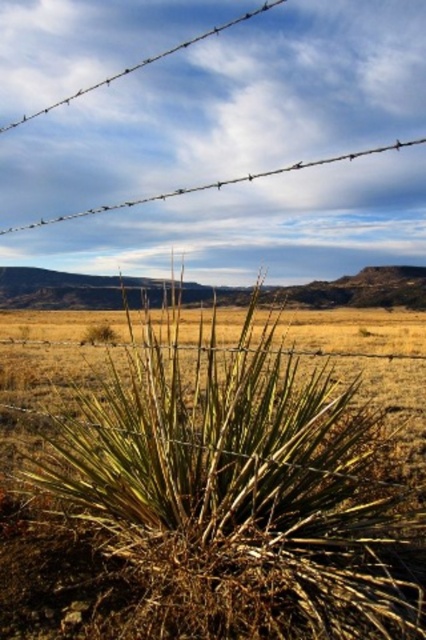
Question: Is the position of brown dry grass at center less distant than that of wire at upper center?

Choices:
 (A) yes
 (B) no

Answer: (A)

Question: Which point is closer to the camera?

Choices:
 (A) (147, 198)
 (B) (305, 467)

Answer: (B)

Question: Does brown dry grass at center have a greater width compared to wire at upper center?

Choices:
 (A) no
 (B) yes

Answer: (A)

Question: Which point is closer to the camera?

Choices:
 (A) (230, 396)
 (B) (175, 48)

Answer: (A)

Question: Is brown dry grass at center thinner than wire at upper center?

Choices:
 (A) yes
 (B) no

Answer: (A)

Question: Which of the following is the closest to the observer?

Choices:
 (A) (176, 413)
 (B) (149, 64)

Answer: (A)